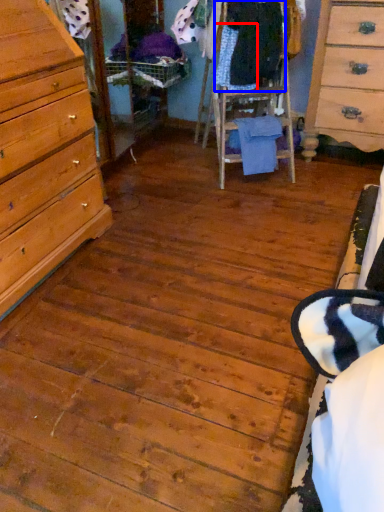
Question: Among these objects, which one is farthest to the camera, clothing (highlighted by a red box) or clothing (highlighted by a blue box)?

Choices:
 (A) clothing
 (B) clothing

Answer: (A)